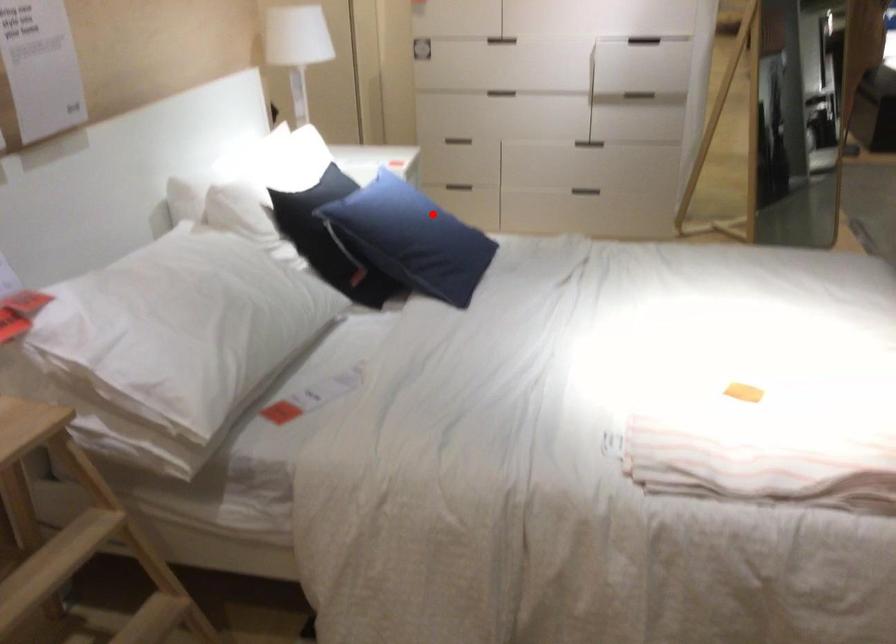
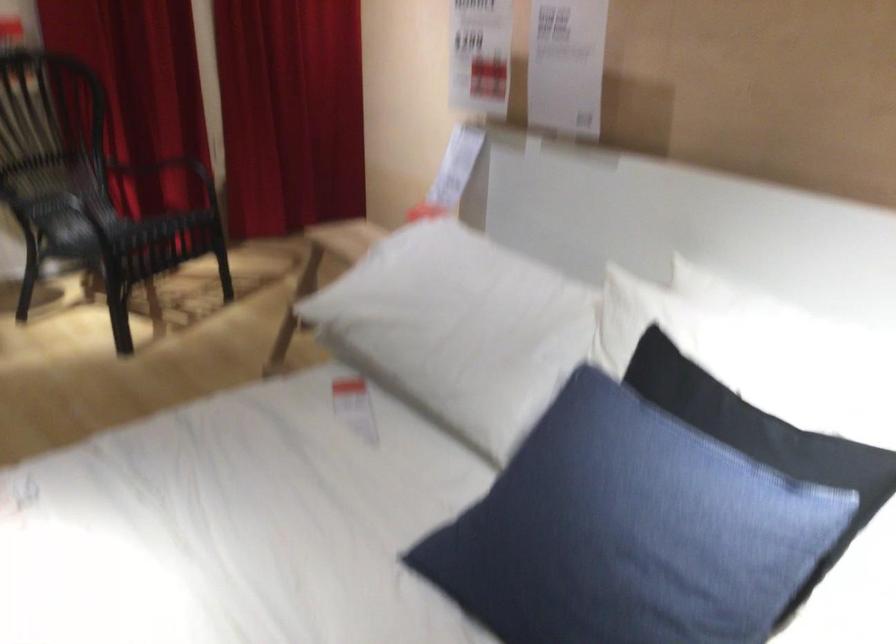
The point at the highlighted location is marked in the first image. Where is the corresponding point in the second image?

(644, 536)